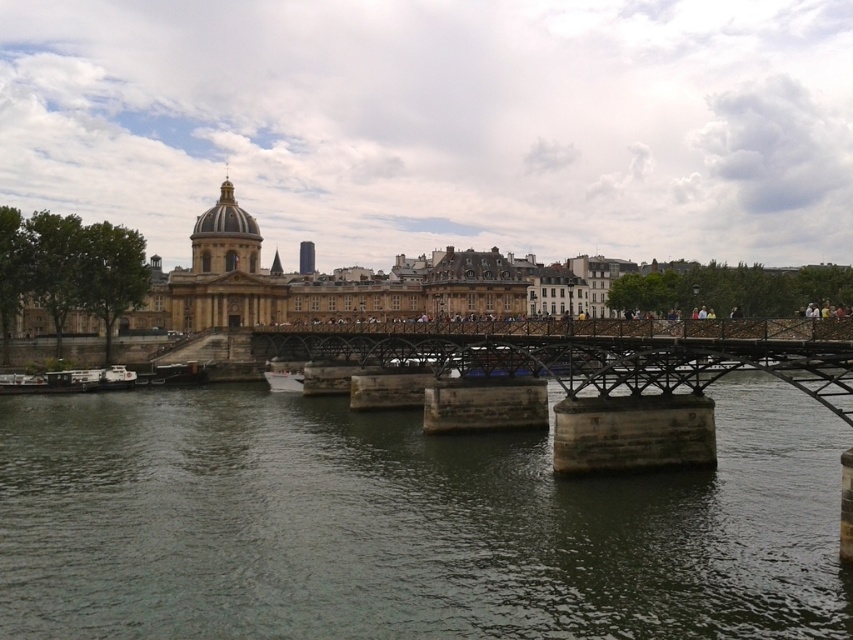
You are standing on the pedestrian bridge and want to cross to the other side. There is a dark gray concrete river at center marked by point [405,524]. Can you safely walk over the dark gray concrete river at center to reach the other side?

The dark gray concrete river at center is represented by point [405,524], so you cannot walk over it since it is a river and not a solid surface.

You are standing at point (x=810, y=360) and want to cross the river to the historical building. The bridge is 54.66 meters away. If your walking speed is 1.5 meters per second, how many seconds will it take you to reach the building?

The distance between point (x=810, y=360) and the historical building is 54.66 meters. At a walking speed of 1.5 meters per second, it would take 54.66 divided by 1.5, which equals approximately 36.44 seconds to reach the historical building.